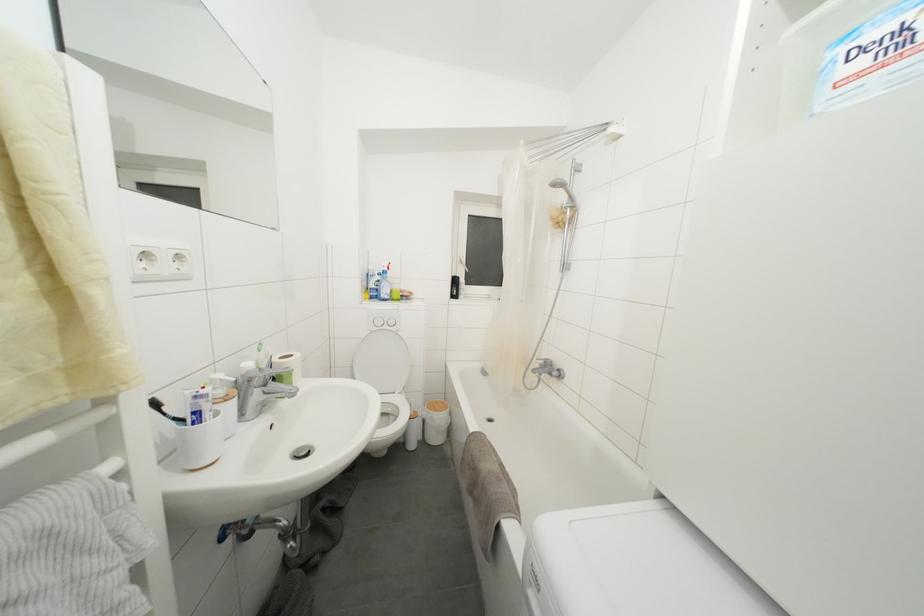
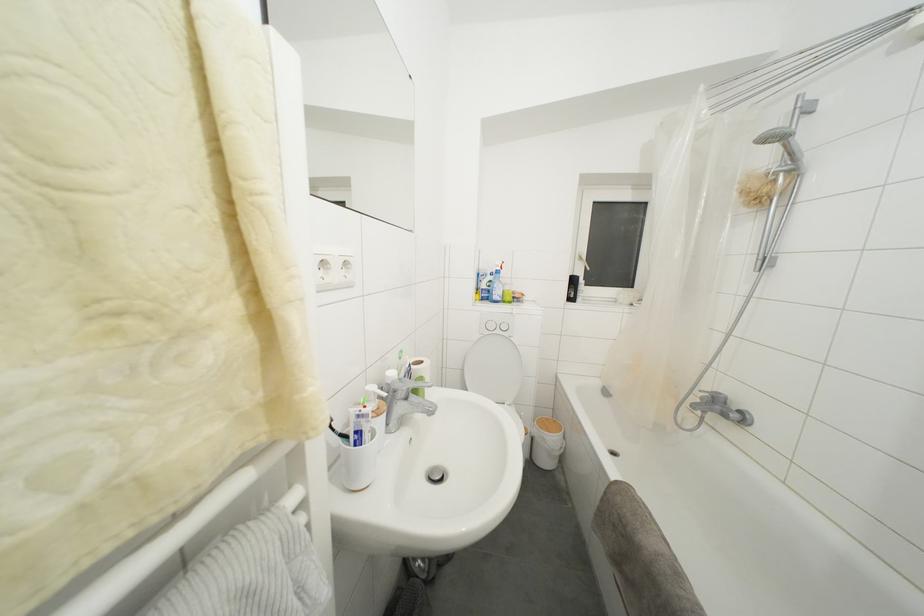
The point at (379, 300) is marked in the first image. Where is the corresponding point in the second image?

(490, 301)